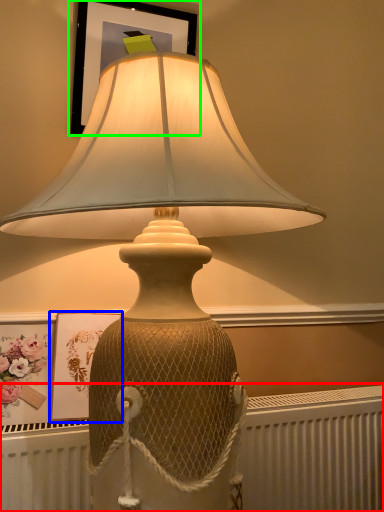
Question: Which object is positioned closest to radiator (highlighted by a red box)? Select from picture frame (highlighted by a blue box) and picture frame (highlighted by a green box).

Choices:
 (A) picture frame
 (B) picture frame

Answer: (A)